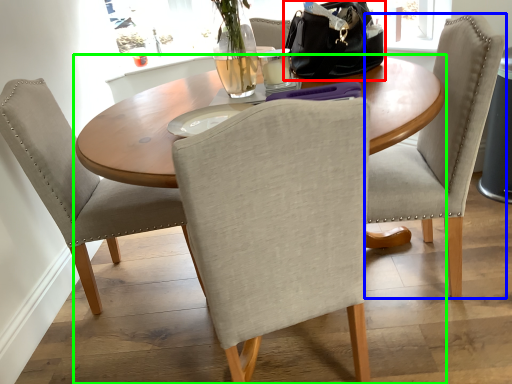
Question: Which object is the farthest from handbag (highlighted by a red box)? Choose among these: chair (highlighted by a blue box) or kitchen & dining room table (highlighted by a green box).

Choices:
 (A) chair
 (B) kitchen & dining room table

Answer: (B)